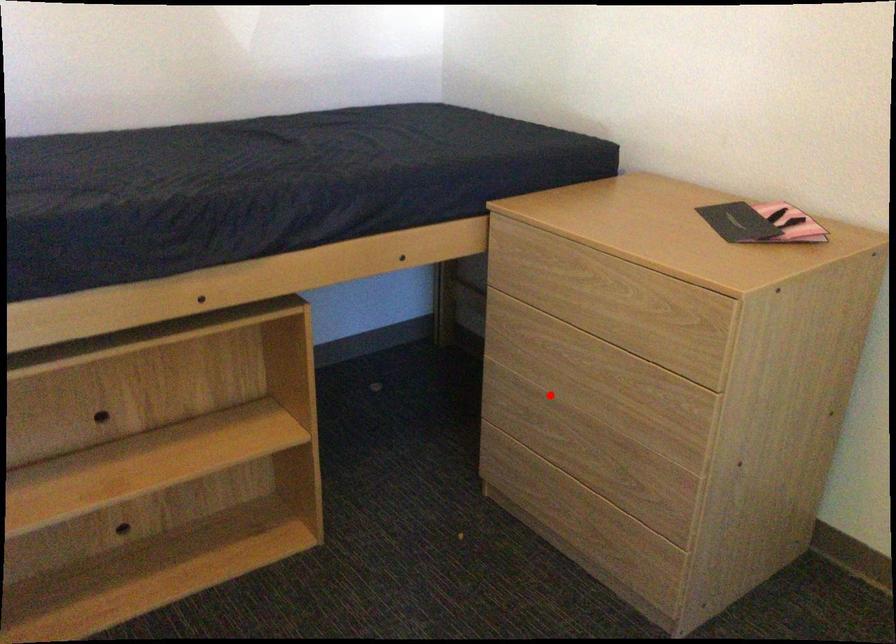
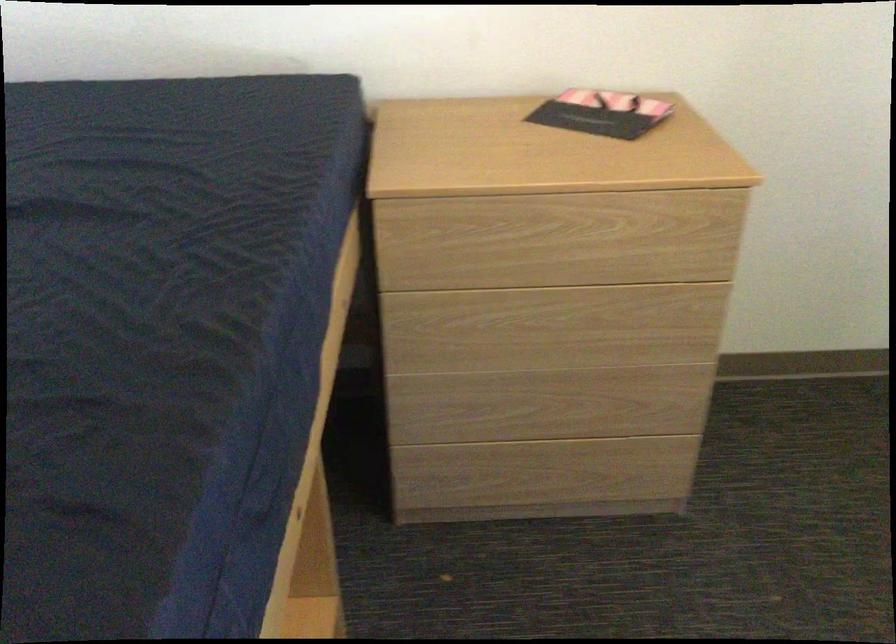
Where in the second image is the point corresponding to the highlighted location from the first image?

(518, 368)